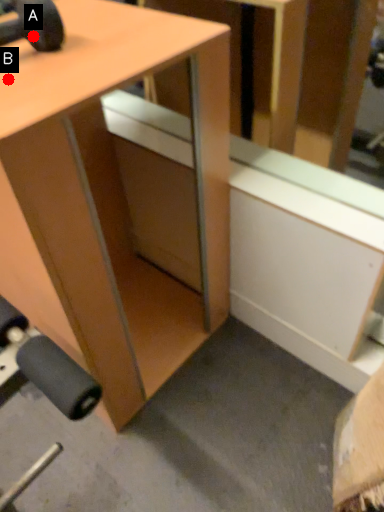
Question: Two points are circled on the image, labeled by A and B beside each circle. Which point is closer to the camera?

Choices:
 (A) A is closer
 (B) B is closer

Answer: (B)